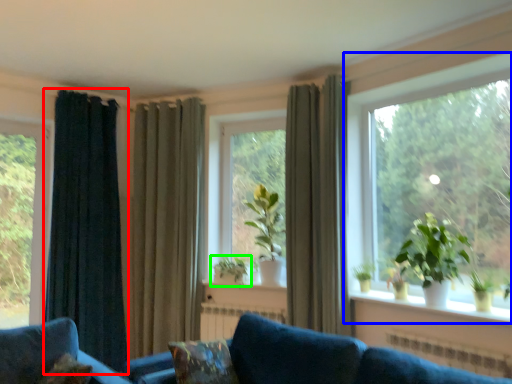
Question: Which is farther away from curtain (highlighted by a red box)? window (highlighted by a blue box) or houseplant (highlighted by a green box)?

Choices:
 (A) window
 (B) houseplant

Answer: (A)